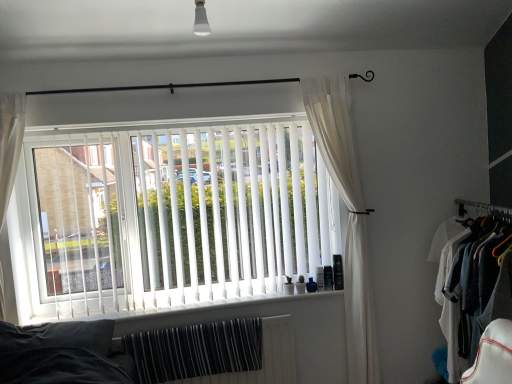
What do you see at coordinates (177, 216) in the screenshot? The image size is (512, 384). I see `white vertical blinds at center` at bounding box center [177, 216].

Identify the location of white plastic window sill at center. The height and width of the screenshot is (384, 512). (244, 312).

Describe the element at coordinates (164, 86) in the screenshot. I see `black metal rod at upper center` at that location.

You are a GUI agent. You are given a task and a screenshot of the screen. Output one action in this format:
    pyautogui.click(x=<x>, y=<y>)
    Task: Click on the white vertical blinds at center
    
    Given the screenshot: What is the action you would take?
    pyautogui.click(x=177, y=216)

Is white vertical blinds at center touching white cotton shirt at right?

white vertical blinds at center is not next to white cotton shirt at right, and they're not touching.

Does white vertical blinds at center appear on the right side of white cotton shirt at right?

In fact, white vertical blinds at center is to the left of white cotton shirt at right.

Can white cotton shirt at right be found inside white vertical blinds at center?

No.

Does point (148, 140) come closer to viewer compared to point (488, 241)?

No.

In terms of height, does black metal rod at upper center look taller or shorter compared to white cotton shirt at right?

In the image, black metal rod at upper center appears to be shorter than white cotton shirt at right.

Does point (239, 83) appear closer or farther from the camera than point (496, 316)?

Clearly, point (239, 83) is more distant from the camera than point (496, 316).

From the image's perspective, which one is positioned higher, black metal rod at upper center or white cotton shirt at right?

From the image's view, black metal rod at upper center is above.

Is black metal rod at upper center positioned with its back to white cotton shirt at right?

No, white cotton shirt at right is not at the back of black metal rod at upper center.

Is white plastic window sill at center behind white striped radiator at lower center?

That is False.

Is white plastic window sill at center at the right side of white striped radiator at lower center?

Incorrect, white plastic window sill at center is not on the right side of white striped radiator at lower center.

Does white striped radiator at lower center have a smaller size compared to white plastic window sill at center?

Incorrect, white striped radiator at lower center is not smaller in size than white plastic window sill at center.

Could you tell me if white striped radiator at lower center is facing white plastic window sill at center?

No, white striped radiator at lower center is not facing towards white plastic window sill at center.

Does white striped radiator at lower center have a lesser height compared to white plastic window sill at center?

In fact, white striped radiator at lower center may be taller than white plastic window sill at center.

Based on the photo, from the image's perspective, which is above, white striped radiator at lower center or white plastic window sill at center?

From the image's view, white plastic window sill at center is above.

Can white vertical blinds at center be found inside white sheer curtain at right?

No, white vertical blinds at center is not surrounded by white sheer curtain at right.

Is white sheer curtain at right in front of or behind white vertical blinds at center in the image?

white sheer curtain at right is positioned farther from the viewer than white vertical blinds at center.

How many degrees apart are the facing directions of white sheer curtain at right and white vertical blinds at center?

1.3 degrees separate the facing orientations of white sheer curtain at right and white vertical blinds at center.

From the image's perspective, is white sheer curtain at right beneath white vertical blinds at center?

Indeed, from the image's perspective, white sheer curtain at right is shown beneath white vertical blinds at center.

Is white vertical blinds at center directly adjacent to white sheer curtain at right?

white vertical blinds at center and white sheer curtain at right are not in contact.

Between white vertical blinds at center and white sheer curtain at right, which one has larger size?

white vertical blinds at center is bigger.

Is white vertical blinds at center to the left or to the right of white sheer curtain at right in the image?

From the image, it's evident that white vertical blinds at center is to the left of white sheer curtain at right.

Is black metal rod at upper center wider than white striped radiator at lower center?

Yes.

Are black metal rod at upper center and white striped radiator at lower center beside each other?

No, black metal rod at upper center is not in contact with white striped radiator at lower center.

Based on the photo, is black metal rod at upper center further to the viewer compared to white striped radiator at lower center?

That is False.

How far apart are black metal rod at upper center and white striped radiator at lower center?

black metal rod at upper center is 1.51 meters away from white striped radiator at lower center.

Identify the location of window blind positioned vertically above the white cotton shirt at right (from a real-world perspective). Image resolution: width=512 pixels, height=384 pixels. (177, 216).

The height and width of the screenshot is (384, 512). Find the location of `clothing below the black metal rod at upper center (from the image's perspective)`. clothing below the black metal rod at upper center (from the image's perspective) is located at coordinates (473, 289).

Considering their positions, is black metal rod at upper center positioned closer to white striped radiator at lower center than white cotton shirt at right?

Based on the image, white cotton shirt at right appears to be nearer to white striped radiator at lower center.

Looking at the image, which one is located further to white vertical blinds at center, white sheer curtain at right or white plastic window sill at center?

The object further to white vertical blinds at center is white sheer curtain at right.

Which object lies further to the anchor point white vertical blinds at center, white plastic window sill at center or black metal rod at upper center?

The object further to white vertical blinds at center is black metal rod at upper center.

Estimate the real-world distances between objects in this image. Which object is closer to white cotton shirt at right, white plastic window sill at center or white vertical blinds at center?

white plastic window sill at center is positioned closer to the anchor white cotton shirt at right.

Consider the image. Which object lies nearer to the anchor point black metal rod at upper center, white vertical blinds at center or white striped radiator at lower center?

white vertical blinds at center is closer to black metal rod at upper center.

Which object lies nearer to the anchor point white sheer curtain at right, black metal rod at upper center or white striped radiator at lower center?

white striped radiator at lower center lies closer to white sheer curtain at right than the other object.

Which object lies further to the anchor point white cotton shirt at right, white sheer curtain at right or white vertical blinds at center?

white vertical blinds at center.

From the image, which object appears to be nearer to white plastic window sill at center, white vertical blinds at center or black metal rod at upper center?

white vertical blinds at center is positioned closer to the anchor white plastic window sill at center.

Identify the location of radiator between white vertical blinds at center and white cotton shirt at right in the horizontal direction. This screenshot has width=512, height=384. pos(263,358).

This screenshot has height=384, width=512. Find the location of `window sill situated between white vertical blinds at center and white sheer curtain at right from left to right`. window sill situated between white vertical blinds at center and white sheer curtain at right from left to right is located at coordinates (244, 312).

Find the location of `curtain between black metal rod at upper center and white cotton shirt at right in the horizontal direction`. curtain between black metal rod at upper center and white cotton shirt at right in the horizontal direction is located at coordinates (348, 218).

The height and width of the screenshot is (384, 512). What are the coordinates of `curtain situated between white vertical blinds at center and white cotton shirt at right from left to right` in the screenshot? It's located at (348, 218).